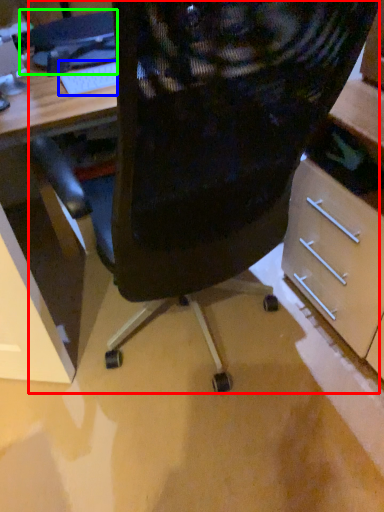
Question: Which object is the farthest from chair (highlighted by a red box)? Choose among these: keyboard (highlighted by a blue box) or computer (highlighted by a green box).

Choices:
 (A) keyboard
 (B) computer

Answer: (B)